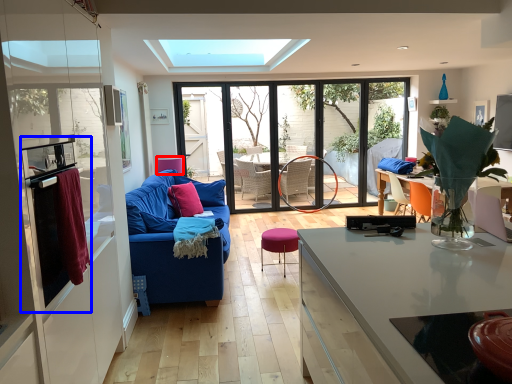
Question: Among these objects, which one is farthest to the camera, armchair (highlighted by a red box) or appliance (highlighted by a blue box)?

Choices:
 (A) armchair
 (B) appliance

Answer: (A)